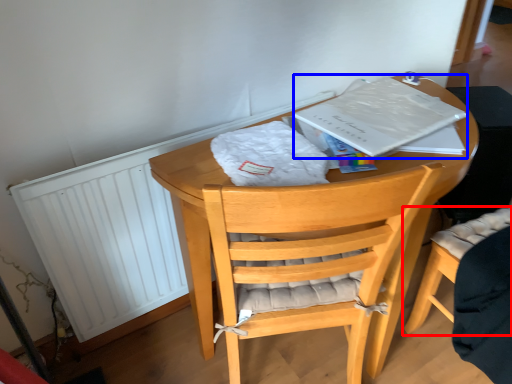
Question: Which object appears closest to the camera in this image, chair (highlighted by a red box) or paperback book (highlighted by a blue box)?

Choices:
 (A) chair
 (B) paperback book

Answer: (A)